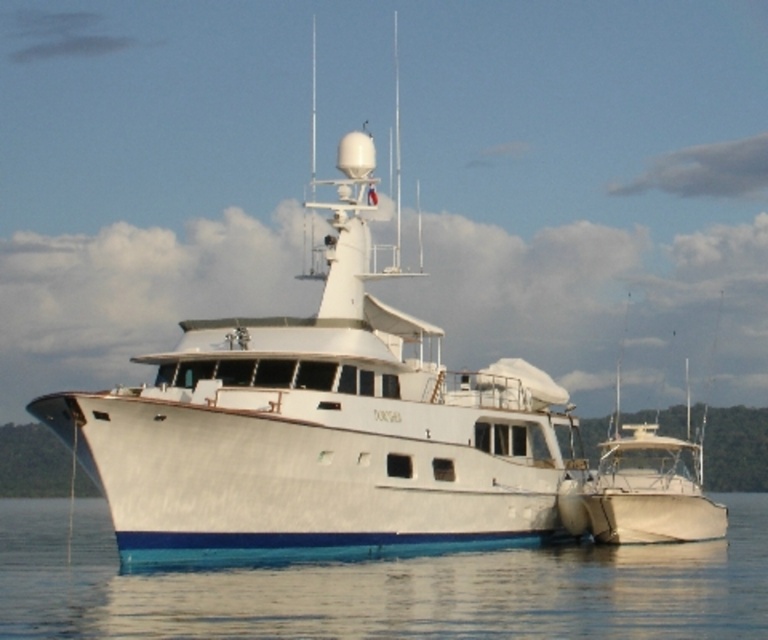
Question: Which point is closer to the camera?

Choices:
 (A) (359, 220)
 (B) (58, 572)

Answer: (B)

Question: Observing the image, what is the correct spatial positioning of white glossy boat at center in reference to clear water at lower center?

Choices:
 (A) right
 (B) left

Answer: (B)

Question: Considering the relative positions of white glossy boat at center and clear water at lower center in the image provided, where is white glossy boat at center located with respect to clear water at lower center?

Choices:
 (A) above
 (B) below

Answer: (A)

Question: Which of the following is the farthest from the observer?

Choices:
 (A) white glossy boat at center
 (B) clear water at lower center

Answer: (A)

Question: Is white glossy boat at center bigger than clear water at lower center?

Choices:
 (A) no
 (B) yes

Answer: (B)

Question: Which of the following is the closest to the observer?

Choices:
 (A) white glossy boat at center
 (B) clear water at lower center

Answer: (B)